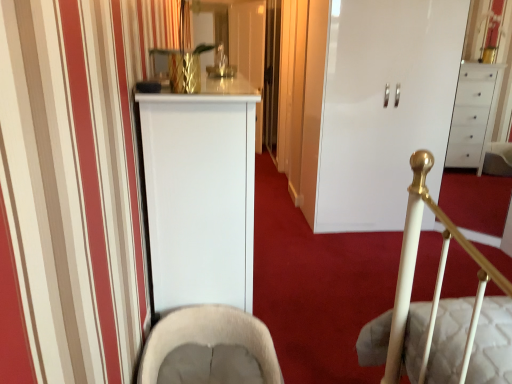
Question: Is point (269, 342) closer or farther from the camera than point (413, 127)?

Choices:
 (A) closer
 (B) farther

Answer: (A)

Question: Is beige fabric rocking chair at lower center inside or outside of white glossy cabinet at center?

Choices:
 (A) inside
 (B) outside

Answer: (B)

Question: From a real-world perspective, relative to white glossy cabinet at center, is beige fabric rocking chair at lower center vertically above or below?

Choices:
 (A) below
 (B) above

Answer: (A)

Question: Is point (359, 135) positioned closer to the camera than point (144, 365)?

Choices:
 (A) closer
 (B) farther

Answer: (B)

Question: From a real-world perspective, is white glossy cabinet at center positioned above or below beige fabric rocking chair at lower center?

Choices:
 (A) below
 (B) above

Answer: (B)

Question: From the image's perspective, is white glossy cabinet at center above or below beige fabric rocking chair at lower center?

Choices:
 (A) above
 (B) below

Answer: (A)

Question: Considering the positions of white glossy cabinet at center and beige fabric rocking chair at lower center in the image, is white glossy cabinet at center taller or shorter than beige fabric rocking chair at lower center?

Choices:
 (A) short
 (B) tall

Answer: (B)